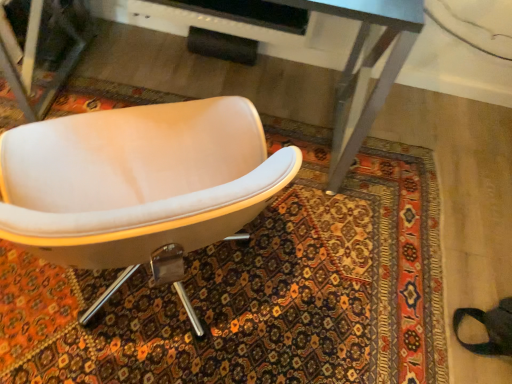
Question: From the image's perspective, is white leather chair at center located above or below metallic gray desk at center?

Choices:
 (A) above
 (B) below

Answer: (B)

Question: Looking at their shapes, would you say white leather chair at center is wider or thinner than metallic gray desk at center?

Choices:
 (A) thin
 (B) wide

Answer: (B)

Question: Considering the relative positions of white leather chair at center and metallic gray desk at center in the image provided, is white leather chair at center to the left or to the right of metallic gray desk at center?

Choices:
 (A) right
 (B) left

Answer: (B)

Question: Is metallic gray desk at center to the left or to the right of white leather chair at center in the image?

Choices:
 (A) left
 (B) right

Answer: (B)

Question: From a real-world perspective, is metallic gray desk at center positioned above or below white leather chair at center?

Choices:
 (A) below
 (B) above

Answer: (A)

Question: Is point (404, 6) closer or farther from the camera than point (69, 221)?

Choices:
 (A) farther
 (B) closer

Answer: (A)

Question: From the image's perspective, is metallic gray desk at center positioned above or below white leather chair at center?

Choices:
 (A) below
 (B) above

Answer: (B)